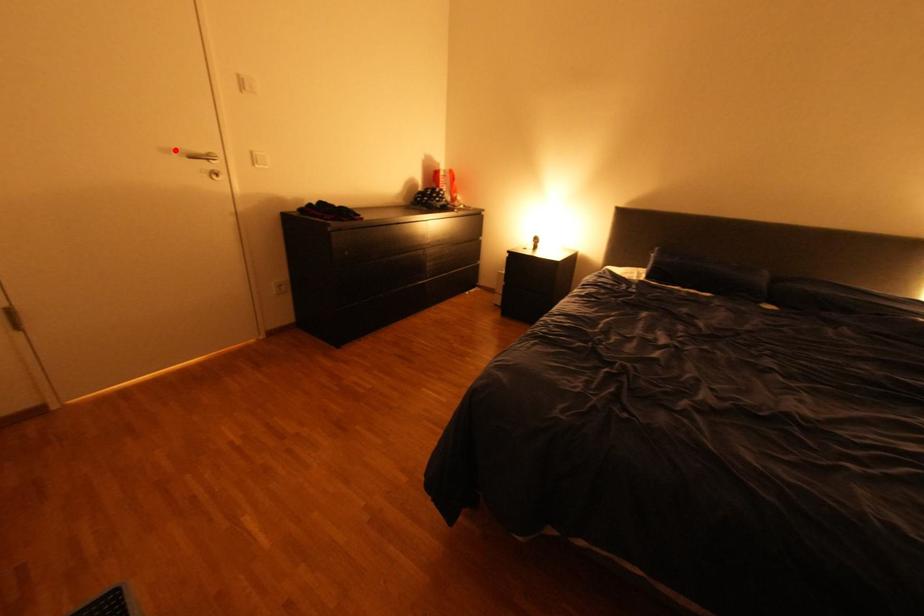
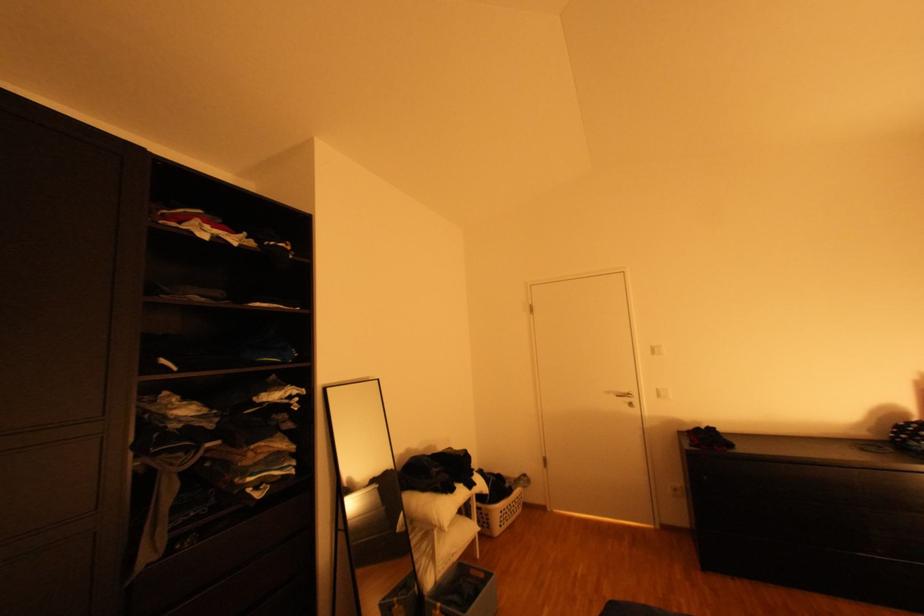
Where in the second image is the point corresponding to the highlighted location from the first image?

(617, 392)